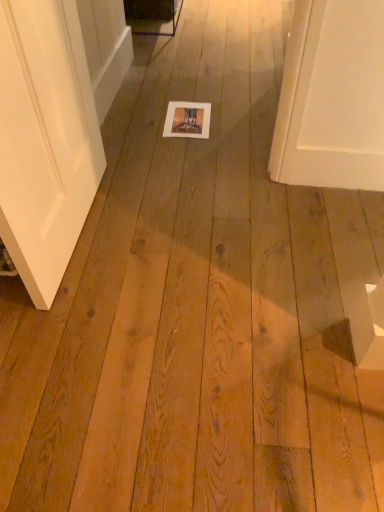
Question: Is point (97, 50) positioned closer to the camera than point (210, 117)?

Choices:
 (A) farther
 (B) closer

Answer: (B)

Question: Considering the positions of white glossy screen door at upper left and matte cardboard postcard at center in the image, is white glossy screen door at upper left bigger or smaller than matte cardboard postcard at center?

Choices:
 (A) small
 (B) big

Answer: (B)

Question: From the image's perspective, is white glossy screen door at upper left positioned above or below matte cardboard postcard at center?

Choices:
 (A) above
 (B) below

Answer: (A)

Question: Considering the positions of matte cardboard postcard at center and white glossy screen door at upper left in the image, is matte cardboard postcard at center bigger or smaller than white glossy screen door at upper left?

Choices:
 (A) big
 (B) small

Answer: (B)

Question: Looking at their shapes, would you say matte cardboard postcard at center is wider or thinner than white glossy screen door at upper left?

Choices:
 (A) thin
 (B) wide

Answer: (B)

Question: From their relative heights in the image, would you say matte cardboard postcard at center is taller or shorter than white glossy screen door at upper left?

Choices:
 (A) tall
 (B) short

Answer: (B)

Question: Is matte cardboard postcard at center spatially inside white glossy screen door at upper left, or outside of it?

Choices:
 (A) inside
 (B) outside

Answer: (B)